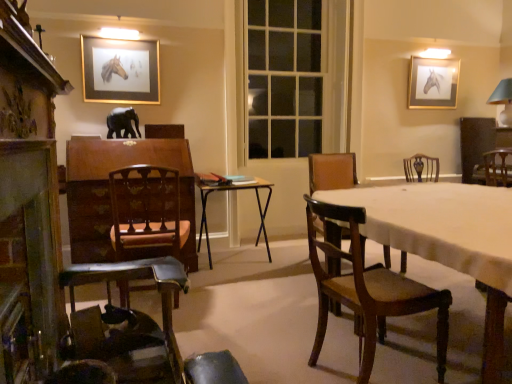
In order to click on free space above gold-framed picture at upper center, positioned as the second picture frame in back-to-front order (from a real-world perspective) in this screenshot , I will do `click(118, 37)`.